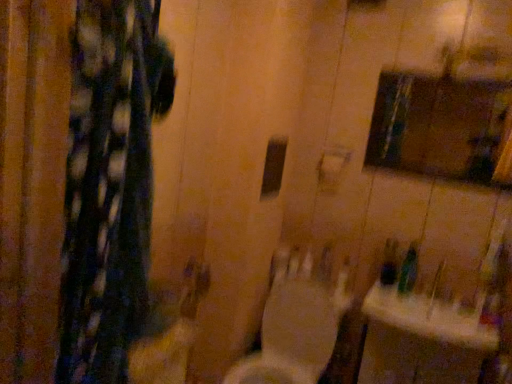
What do you see at coordinates (408, 270) in the screenshot? This screenshot has height=384, width=512. I see `green plastic bottle at lower right` at bounding box center [408, 270].

What do you see at coordinates (432, 317) in the screenshot? This screenshot has height=384, width=512. I see `white glossy sink at lower right` at bounding box center [432, 317].

Find the location of `green plastic bottle at lower right`. green plastic bottle at lower right is located at coordinates (408, 270).

Is white glossy toilet at center facing away from matte glass medicine cabinet at upper right?

No, white glossy toilet at center's orientation is not away from matte glass medicine cabinet at upper right.

Considering the sizes of objects white glossy toilet at center and matte glass medicine cabinet at upper right in the image provided, who is smaller, white glossy toilet at center or matte glass medicine cabinet at upper right?

matte glass medicine cabinet at upper right.

From a real-world perspective, is white glossy toilet at center positioned under matte glass medicine cabinet at upper right based on gravity?

Yes, from a real-world perspective, white glossy toilet at center is under matte glass medicine cabinet at upper right.

This screenshot has width=512, height=384. Find the location of `toiletry on the left of matte glass medicine cabinet at upper right`. toiletry on the left of matte glass medicine cabinet at upper right is located at coordinates (408, 270).

From the image's perspective, is matte glass medicine cabinet at upper right located above or below green plastic bottle at lower right?

matte glass medicine cabinet at upper right is situated higher than green plastic bottle at lower right in the image.

Is matte glass medicine cabinet at upper right thinner than green plastic bottle at lower right?

Indeed, matte glass medicine cabinet at upper right has a lesser width compared to green plastic bottle at lower right.

Which is correct: matte glass medicine cabinet at upper right is inside green plastic bottle at lower right, or outside of it?

Answer: matte glass medicine cabinet at upper right is spatially situated outside green plastic bottle at lower right.

The width and height of the screenshot is (512, 384). I want to click on toiletry above the white glossy toilet at center (from the image's perspective), so click(408, 270).

Can you confirm if white glossy toilet at center is taller than green plastic bottle at lower right?

Yes.

Is white glossy toilet at center not near green plastic bottle at lower right?

No, white glossy toilet at center is not far from green plastic bottle at lower right.

Is point (335, 314) positioned behind point (404, 271)?

No, it is not.

At what (x,y) coordinates should I click in order to perform the action: click on sink in front of the green plastic bottle at lower right. Please return your answer as a coordinate pair (x, y). The image size is (512, 384). Looking at the image, I should click on (432, 317).

From a real-world perspective, which is physically below, green plastic bottle at lower right or white glossy sink at lower right?

In real-world perspective, white glossy sink at lower right is lower.

What's the angular difference between green plastic bottle at lower right and white glossy sink at lower right's facing directions?

The facing directions of green plastic bottle at lower right and white glossy sink at lower right are 4.45 degrees apart.

Which of these two, green plastic bottle at lower right or white glossy sink at lower right, stands taller?

green plastic bottle at lower right is taller.

From a real-world perspective, is white glossy toilet at center above or below white glossy sink at lower right?

white glossy toilet at center is situated lower than white glossy sink at lower right in the real world.

Is white glossy sink at lower right at the back of white glossy toilet at center?

No.

From the image's perspective, who appears lower, white glossy toilet at center or white glossy sink at lower right?

white glossy toilet at center.

Is white glossy toilet at center positioned before white glossy sink at lower right?

Yes, white glossy toilet at center is in front of white glossy sink at lower right.

Could you tell me if white glossy sink at lower right is turned towards matte glass medicine cabinet at upper right?

No, white glossy sink at lower right is not oriented towards matte glass medicine cabinet at upper right.

Between white glossy sink at lower right and matte glass medicine cabinet at upper right, which one has smaller size?

matte glass medicine cabinet at upper right.

From the image's perspective, who appears lower, white glossy sink at lower right or matte glass medicine cabinet at upper right?

From the image's view, white glossy sink at lower right is below.

Does white glossy sink at lower right have a greater height compared to matte glass medicine cabinet at upper right?

No.

From the image's perspective, which object appears higher, matte glass medicine cabinet at upper right or white glossy sink at lower right?

matte glass medicine cabinet at upper right.

How many degrees apart are the facing directions of matte glass medicine cabinet at upper right and white glossy sink at lower right?

matte glass medicine cabinet at upper right and white glossy sink at lower right are facing 0.299 degrees away from each other.

Is matte glass medicine cabinet at upper right surrounding white glossy sink at lower right?

No.

Where is `medicine cabinet on the right of white glossy toilet at center`? The image size is (512, 384). medicine cabinet on the right of white glossy toilet at center is located at coordinates (439, 127).

At what (x,y) coordinates should I click in order to perform the action: click on toiletry on the left of matte glass medicine cabinet at upper right. Please return your answer as a coordinate pair (x, y). Image resolution: width=512 pixels, height=384 pixels. Looking at the image, I should click on (408, 270).

From the image, which object appears to be nearer to white glossy sink at lower right, matte glass medicine cabinet at upper right or green plastic bottle at lower right?

Based on the image, green plastic bottle at lower right appears to be nearer to white glossy sink at lower right.

When comparing their distances from white glossy sink at lower right, does matte glass medicine cabinet at upper right or white glossy toilet at center seem closer?

white glossy toilet at center lies closer to white glossy sink at lower right than the other object.

Based on their spatial positions, is matte glass medicine cabinet at upper right or white glossy toilet at center further from green plastic bottle at lower right?

Among the two, matte glass medicine cabinet at upper right is located further to green plastic bottle at lower right.

Which object lies further to the anchor point green plastic bottle at lower right, white glossy toilet at center or white glossy sink at lower right?

white glossy toilet at center is positioned further to the anchor green plastic bottle at lower right.

Looking at the image, which one is located further to matte glass medicine cabinet at upper right, green plastic bottle at lower right or white glossy toilet at center?

Among the two, white glossy toilet at center is located further to matte glass medicine cabinet at upper right.

Based on the photo, from the image, which object appears to be farther from white glossy toilet at center, green plastic bottle at lower right or matte glass medicine cabinet at upper right?

matte glass medicine cabinet at upper right lies further to white glossy toilet at center than the other object.

Based on their spatial positions, is white glossy toilet at center or green plastic bottle at lower right further from white glossy sink at lower right?

Based on the image, white glossy toilet at center appears to be further to white glossy sink at lower right.

When comparing their distances from white glossy sink at lower right, does green plastic bottle at lower right or white glossy toilet at center seem closer?

green plastic bottle at lower right lies closer to white glossy sink at lower right than the other object.

Identify the location of toiletry between matte glass medicine cabinet at upper right and white glossy sink at lower right in the vertical direction. Image resolution: width=512 pixels, height=384 pixels. (408, 270).

At what (x,y) coordinates should I click in order to perform the action: click on toiletry between matte glass medicine cabinet at upper right and white glossy toilet at center in the up-down direction. Please return your answer as a coordinate pair (x, y). This screenshot has width=512, height=384. Looking at the image, I should click on (408, 270).

You are a GUI agent. You are given a task and a screenshot of the screen. Output one action in this format:
    pyautogui.click(x=<x>, y=<y>)
    Task: Click on the toiletry between white glossy toilet at center and white glossy sink at lower right from left to right
    The width and height of the screenshot is (512, 384).
    Given the screenshot: What is the action you would take?
    pyautogui.click(x=408, y=270)

Locate an element on the screen. sink between matte glass medicine cabinet at upper right and white glossy toilet at center in the up-down direction is located at coordinates (432, 317).